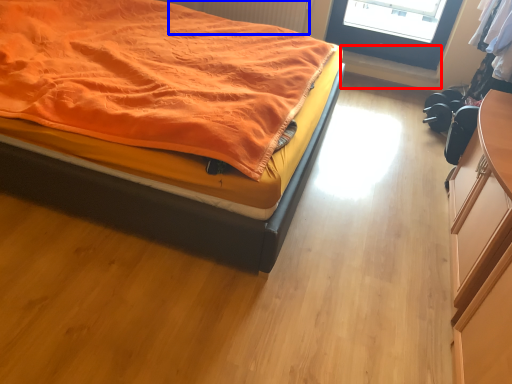
Question: Which of the following is the farthest to the observer, window sill (highlighted by a red box) or radiator (highlighted by a blue box)?

Choices:
 (A) window sill
 (B) radiator

Answer: (A)